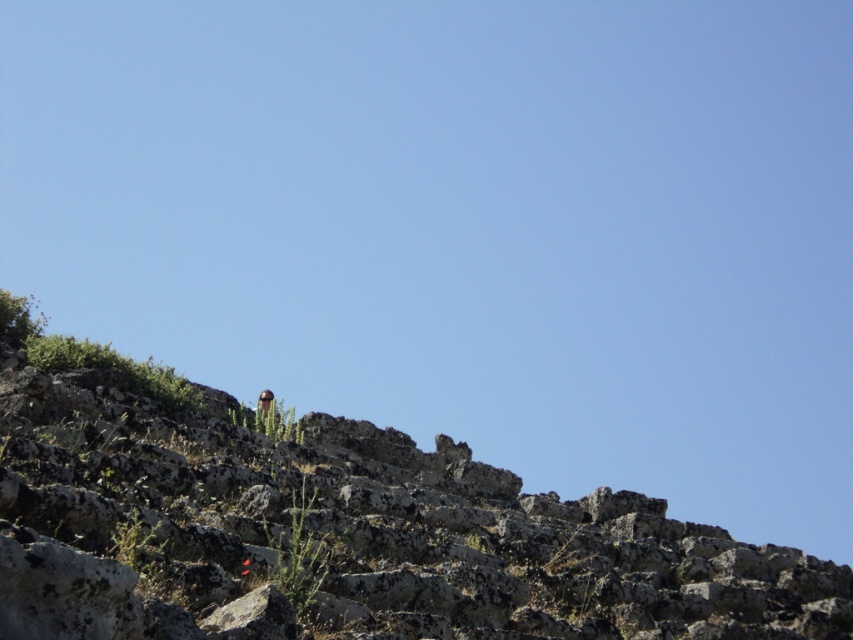
You are a hiker who has just arrived at the rugged rocky terrain. You notice the rough stone hillside at upper center and the brown leather jacket at upper center. Which object is smaller in size?

The rough stone hillside at upper center is smaller in size compared to the brown leather jacket at upper center.

You are a hiker who wants to place your brown leather jacket at upper center on a flat surface. Looking at the rough stone hillside at upper center, can you tell if it has a flat enough area to place your jacket?

The rough stone hillside at upper center is closer to the viewer than the brown leather jacket at upper center, but the description does not provide information about the flatness of the hillside. Therefore, it is unclear if the rough stone hillside at upper center has a flat enough area to place the jacket.